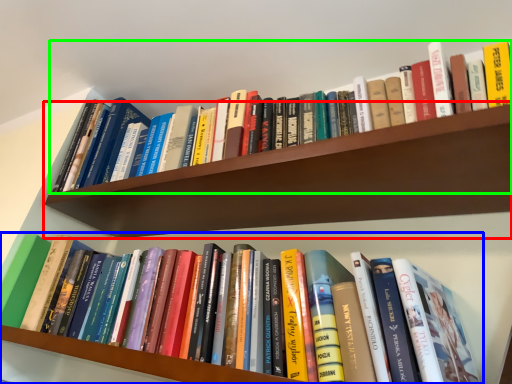
Question: Based on their relative distances, which object is farther from shelf (highlighted by a red box)? Choose from book (highlighted by a blue box) and book (highlighted by a green box).

Choices:
 (A) book
 (B) book

Answer: (A)